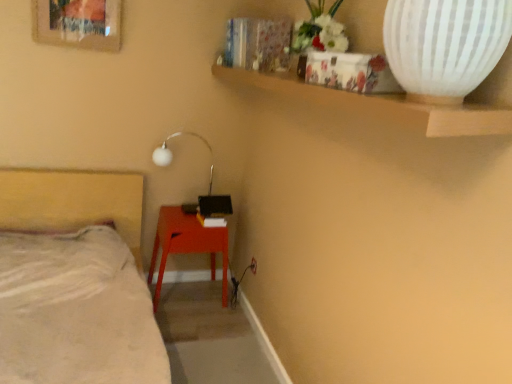
Question: Is matte red table at lower center to the left or to the right of white ribbed vase at upper right in the image?

Choices:
 (A) left
 (B) right

Answer: (A)

Question: Would you say matte red table at lower center is inside or outside white ribbed vase at upper right?

Choices:
 (A) outside
 (B) inside

Answer: (A)

Question: Which object is the closest to the white ribbed vase at upper right?

Choices:
 (A) matte red table at lower center
 (B) white soft bed at lower left
 (C) white glossy lamp at upper center
 (D) wooden picture frame at upper left

Answer: (B)

Question: Estimate the real-world distances between objects in this image. Which object is farther from the matte red table at lower center?

Choices:
 (A) wooden picture frame at upper left
 (B) white ribbed vase at upper right
 (C) white glossy lamp at upper center
 (D) white soft bed at lower left

Answer: (B)